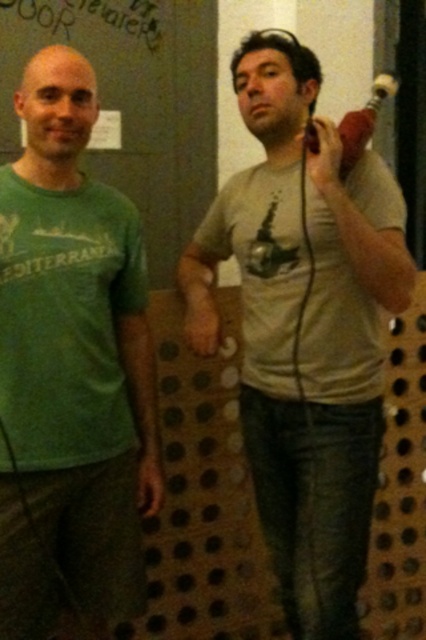
Question: Is green matte t-shirt at left further to the viewer compared to wooden game controller at upper right?

Choices:
 (A) no
 (B) yes

Answer: (A)

Question: Which of the following is the closest to the observer?

Choices:
 (A) (333, 388)
 (B) (365, 113)
 (C) (135, 230)

Answer: (B)

Question: Is green matte t-shirt at left further to the viewer compared to wooden game controller at upper right?

Choices:
 (A) yes
 (B) no

Answer: (B)

Question: Which point appears farthest from the camera in this image?

Choices:
 (A) (140, 442)
 (B) (351, 116)
 (C) (356, 326)

Answer: (A)

Question: Which object is farther from the camera taking this photo?

Choices:
 (A) wooden game controller at upper right
 (B) gray matte t-shirt at center
 (C) green matte t-shirt at left

Answer: (A)

Question: Does gray matte t-shirt at center appear under green matte t-shirt at left?

Choices:
 (A) no
 (B) yes

Answer: (A)